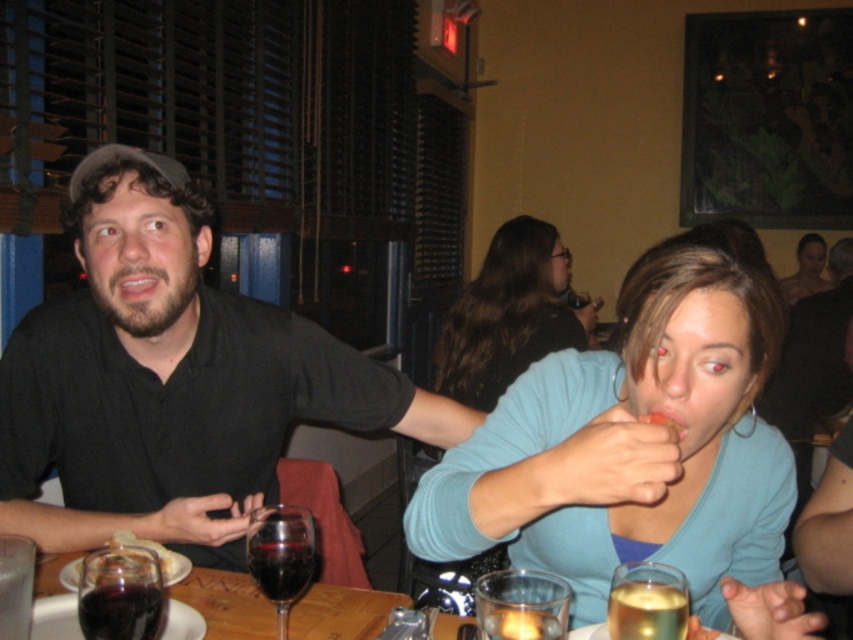
You are a server at the restaurant and need to place a napkin between the translucent glass wine glass at center and the transparent glass at lower center. Which glass should you place the napkin closer to if you want it to be centered between them?

Since the translucent glass wine glass at center is wider than the transparent glass at lower center, you should place the napkin closer to the transparent glass at lower center to center it between them.

You are a photographer taking a picture of the brown hair at center and the slightly browned bread at mouth. Which object is closer to the camera?

The brown hair at center is closer to the camera because it is positioned over the slightly browned bread at mouth, meaning it is in front of it.

You are a photographer trying to capture the man with brown hair at center and the woman with slightly browned bread at mouth. Based on their positions, which subject is closer to the camera?

The brown hair at center is to the left of slightly browned bread at mouth, so the brown hair at center is closer to the camera.